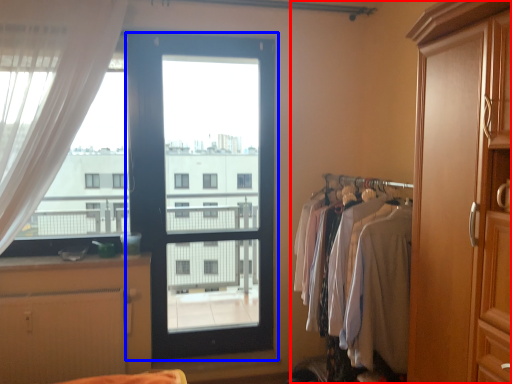
Question: Among these objects, which one is farthest to the camera, dresser (highlighted by a red box) or door (highlighted by a blue box)?

Choices:
 (A) dresser
 (B) door

Answer: (B)